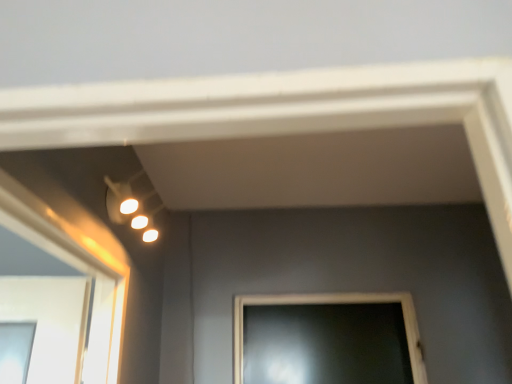
Question: Should I look upward or downward to see white glossy spotlights at upper center?

Choices:
 (A) down
 (B) up

Answer: (A)